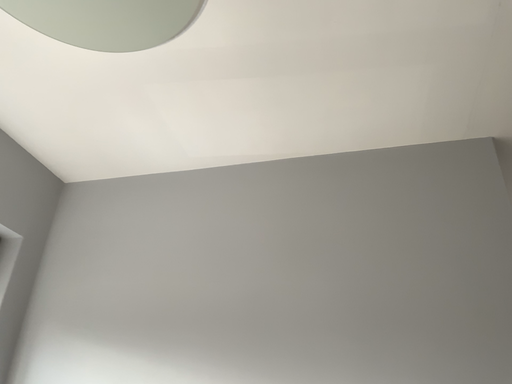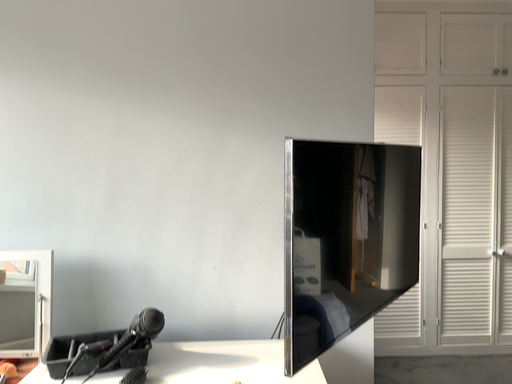
Question: Which way did the camera rotate in the video?

Choices:
 (A) rotated right
 (B) rotated left

Answer: (A)